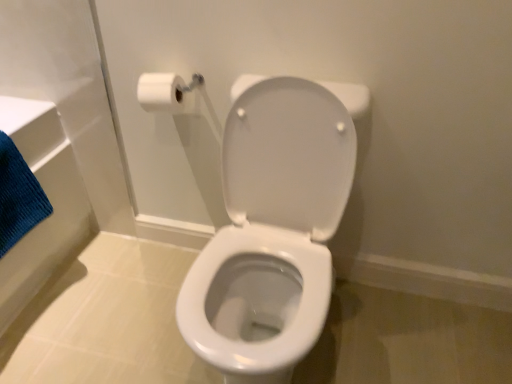
The height and width of the screenshot is (384, 512). What do you see at coordinates (167, 93) in the screenshot? I see `white matte toilet paper at upper left` at bounding box center [167, 93].

At what (x,y) coordinates should I click in order to perform the action: click on white matte toilet paper at upper left. Please return your answer as a coordinate pair (x, y). The width and height of the screenshot is (512, 384). Looking at the image, I should click on (167, 93).

Does white glossy toilet at center contain white matte toilet paper at upper left?

No, white matte toilet paper at upper left is not inside white glossy toilet at center.

From the picture: From the image's perspective, between white glossy toilet at center and white matte toilet paper at upper left, which one is located above?

white matte toilet paper at upper left appears higher in the image.

Can you confirm if white glossy toilet at center is bigger than white matte toilet paper at upper left?

Yes, white glossy toilet at center is bigger than white matte toilet paper at upper left.

This screenshot has width=512, height=384. What are the coordinates of `toilet in front of the white matte toilet paper at upper left` in the screenshot? It's located at (271, 232).

From a real-world perspective, is blue textured bath towel at left located beneath white glossy toilet at center?

No, from a real-world perspective, blue textured bath towel at left is not below white glossy toilet at center.

You are a GUI agent. You are given a task and a screenshot of the screen. Output one action in this format:
    pyautogui.click(x=<x>, y=<y>)
    Task: Click on the bath towel above the white glossy toilet at center (from the image's perspective)
    
    Given the screenshot: What is the action you would take?
    pyautogui.click(x=18, y=196)

Consider the image. How many degrees apart are the facing directions of blue textured bath towel at left and white glossy toilet at center?

The facing directions of blue textured bath towel at left and white glossy toilet at center are 91.2 degrees apart.

Could you tell me if blue textured bath towel at left is facing white glossy toilet at center?

Yes, blue textured bath towel at left faces towards white glossy toilet at center.

Measure the distance from white matte toilet paper at upper left to blue textured bath towel at left.

19.53 inches.

From a real-world perspective, who is located lower, white matte toilet paper at upper left or blue textured bath towel at left?

blue textured bath towel at left, from a real-world perspective.

Is white matte toilet paper at upper left looking in the opposite direction of blue textured bath towel at left?

No, white matte toilet paper at upper left's orientation is not away from blue textured bath towel at left.

Which of these two, white matte toilet paper at upper left or blue textured bath towel at left, is bigger?

blue textured bath towel at left.

Measure the distance between blue textured bath towel at left and white matte toilet paper at upper left.

blue textured bath towel at left is 19.53 inches away from white matte toilet paper at upper left.

Which object is closer to the camera, blue textured bath towel at left or white matte toilet paper at upper left?

blue textured bath towel at left is closer to the camera.

Which is more to the left, blue textured bath towel at left or white matte toilet paper at upper left?

Positioned to the left is blue textured bath towel at left.

Would you consider blue textured bath towel at left to be distant from white matte toilet paper at upper left?

blue textured bath towel at left is near white matte toilet paper at upper left, not far away.

Looking at this image, from a real-world perspective, between white matte toilet paper at upper left and white glossy toilet at center, who is vertically lower?

In real-world perspective, white glossy toilet at center is lower.

Does white matte toilet paper at upper left come behind white glossy toilet at center?

Yes, white matte toilet paper at upper left is further from the viewer.

Based on the photo, would you say white matte toilet paper at upper left is outside white glossy toilet at center?

Yes.

From their relative heights in the image, would you say white matte toilet paper at upper left is taller or shorter than white glossy toilet at center?

white matte toilet paper at upper left is shorter than white glossy toilet at center.

How distant is white glossy toilet at center from blue textured bath towel at left?

The distance of white glossy toilet at center from blue textured bath towel at left is 29.62 inches.

Is white glossy toilet at center taller or shorter than blue textured bath towel at left?

Clearly, white glossy toilet at center is taller compared to blue textured bath towel at left.

Identify the location of bath towel above the white glossy toilet at center (from the image's perspective). (18, 196).

Between white glossy toilet at center and blue textured bath towel at left, which one has larger size?

With larger size is white glossy toilet at center.

Identify the location of toilet in front of the white matte toilet paper at upper left. (271, 232).

The height and width of the screenshot is (384, 512). Identify the location of toilet below the blue textured bath towel at left (from the image's perspective). (271, 232).

Looking at the image, which one is located further to white glossy toilet at center, blue textured bath towel at left or white matte toilet paper at upper left?

blue textured bath towel at left is positioned further to the anchor white glossy toilet at center.

Based on their spatial positions, is white matte toilet paper at upper left or blue textured bath towel at left closer to white glossy toilet at center?

white matte toilet paper at upper left is positioned closer to the anchor white glossy toilet at center.

In the scene shown: From the image, which object appears to be nearer to white matte toilet paper at upper left, white glossy toilet at center or blue textured bath towel at left?

white glossy toilet at center is positioned closer to the anchor white matte toilet paper at upper left.

Considering their positions, is blue textured bath towel at left positioned further to white matte toilet paper at upper left than white glossy toilet at center?

blue textured bath towel at left.

Consider the image. Considering their positions, is white glossy toilet at center positioned further to blue textured bath towel at left than white matte toilet paper at upper left?

white glossy toilet at center lies further to blue textured bath towel at left than the other object.

From the image, which object appears to be nearer to blue textured bath towel at left, white matte toilet paper at upper left or white glossy toilet at center?

white matte toilet paper at upper left.

Image resolution: width=512 pixels, height=384 pixels. I want to click on toilet paper situated between blue textured bath towel at left and white glossy toilet at center from left to right, so click(x=167, y=93).